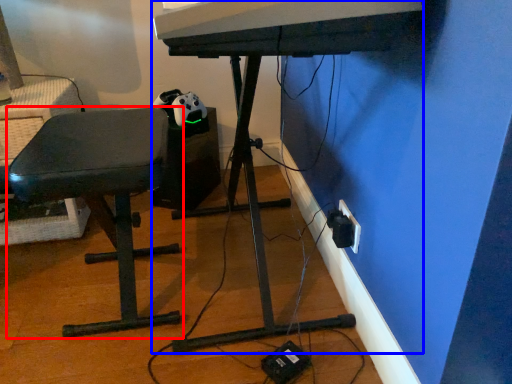
Question: Which object appears closest to the camera in this image, furniture (highlighted by a red box) or computer desk (highlighted by a blue box)?

Choices:
 (A) furniture
 (B) computer desk

Answer: (B)